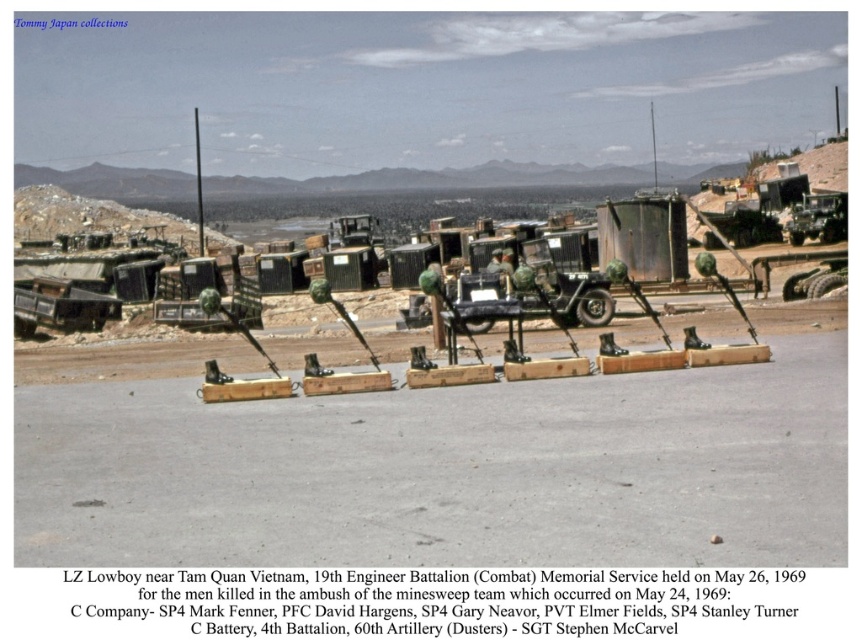
Question: Which point is closer to the camera taking this photo?

Choices:
 (A) click(835, 241)
 (B) click(98, 301)

Answer: (B)

Question: Is matte black truck at left to the right of matte green military vehicle at right from the viewer's perspective?

Choices:
 (A) no
 (B) yes

Answer: (A)

Question: Is matte black truck at left above matte green military vehicle at right?

Choices:
 (A) yes
 (B) no

Answer: (B)

Question: Which object is farther from the camera taking this photo?

Choices:
 (A) matte green military vehicle at right
 (B) matte black truck at left

Answer: (A)

Question: Is matte black truck at left positioned before matte green military vehicle at right?

Choices:
 (A) no
 (B) yes

Answer: (B)